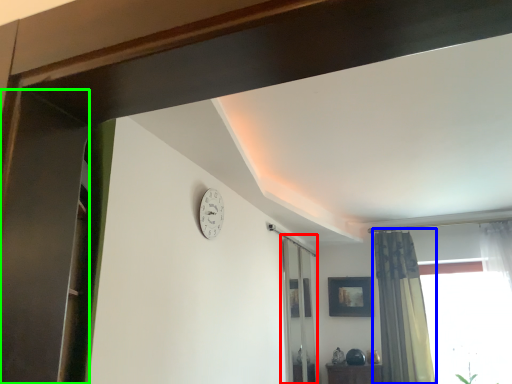
Question: Considering the real-world distances, which object is farthest from screen door (highlighted by a red box)? curtain (highlighted by a blue box) or screen door (highlighted by a green box)?

Choices:
 (A) curtain
 (B) screen door

Answer: (B)